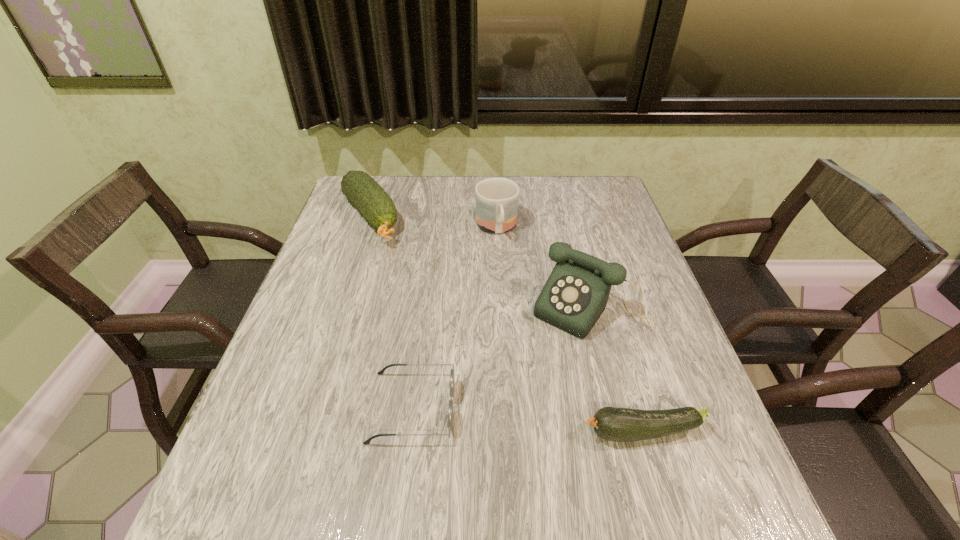
The height and width of the screenshot is (540, 960). I want to click on mug at the far edge, so click(x=496, y=199).

At what (x,y) coordinates should I click in order to perform the action: click on cucumber located at the far edge. Please return your answer as a coordinate pair (x, y). Image resolution: width=960 pixels, height=540 pixels. Looking at the image, I should click on click(x=375, y=205).

Find the location of a particular element. The width and height of the screenshot is (960, 540). sunglasses located at the near edge is located at coordinates (452, 374).

I want to click on zucchini positioned at the near edge, so click(617, 424).

The image size is (960, 540). Find the location of `object positioned at the left edge`. object positioned at the left edge is located at coordinates (375, 205).

Find the location of a particular element. zucchini that is at the right edge is located at coordinates (617, 424).

The width and height of the screenshot is (960, 540). In order to click on telephone that is positioned at the right edge in this screenshot , I will do `click(575, 295)`.

Locate an element on the screen. This screenshot has height=540, width=960. object that is at the far left corner is located at coordinates (375, 205).

Where is `object that is at the near right corner`? The width and height of the screenshot is (960, 540). object that is at the near right corner is located at coordinates (617, 424).

The height and width of the screenshot is (540, 960). I want to click on free space at the far edge of the desktop, so click(x=422, y=199).